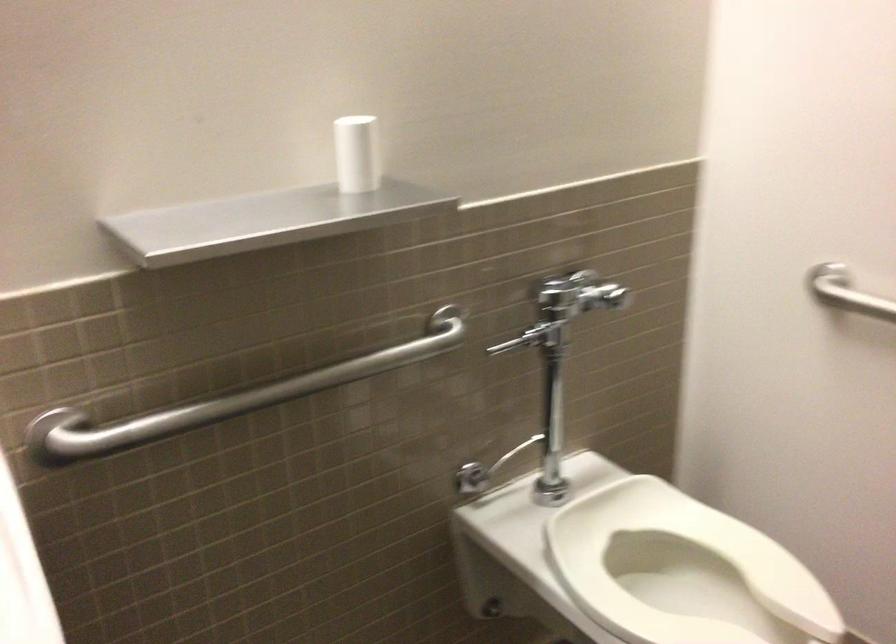
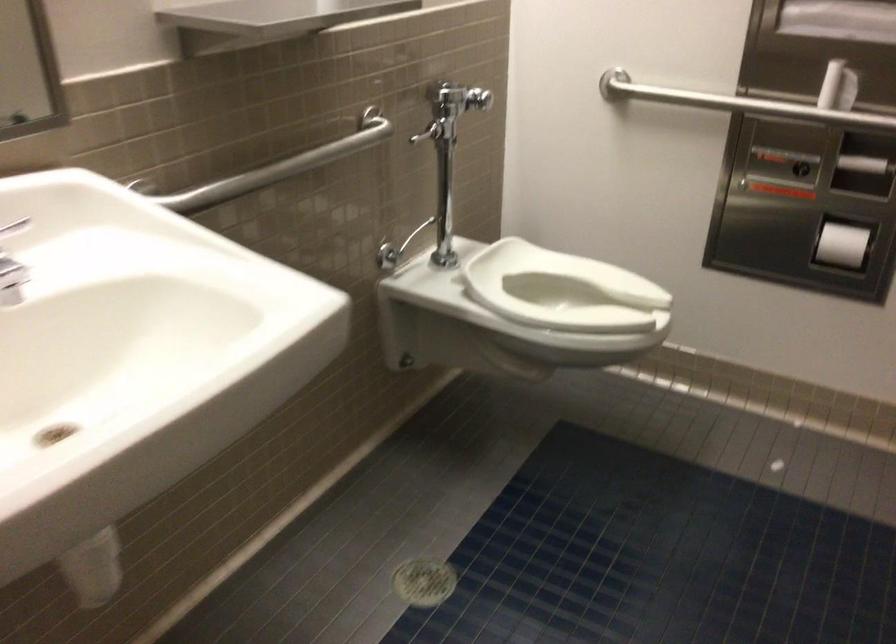
In the second image, find the point that corresponds to (x=712, y=564) in the first image.

(563, 290)